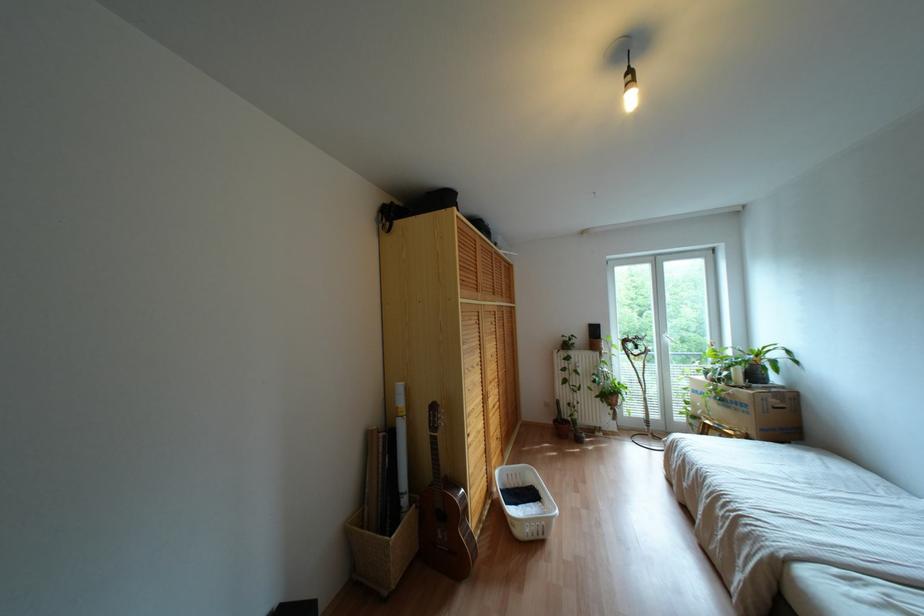
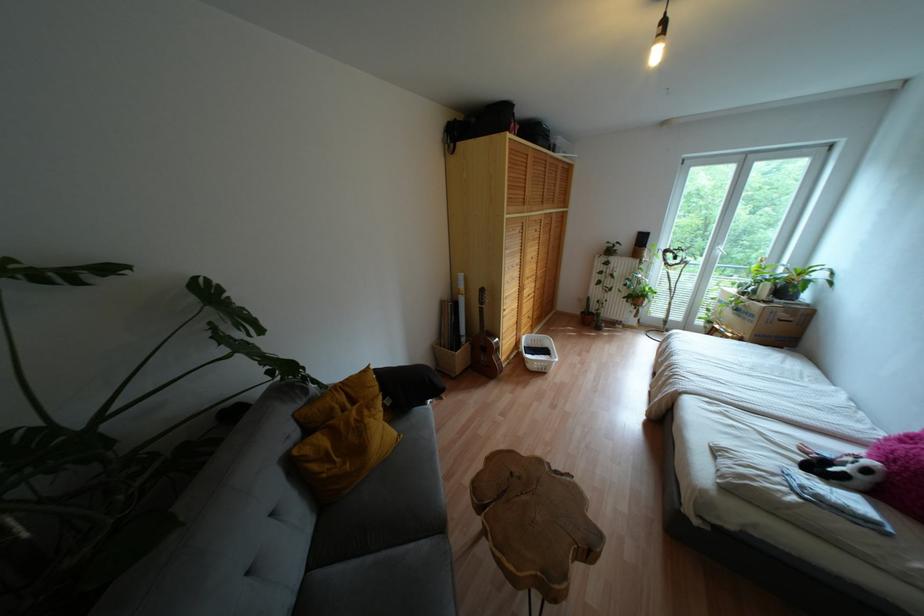
Where in the second image is the point corresponding to pixel 433 407 from the first image?

(481, 290)